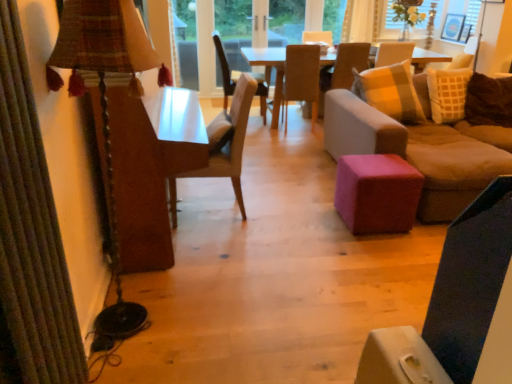
At what (x,y) coordinates should I click in order to perform the action: click on free space in front of textured fabric lampshade at left. Please return your answer as a coordinate pair (x, y). Looking at the image, I should click on (146, 356).